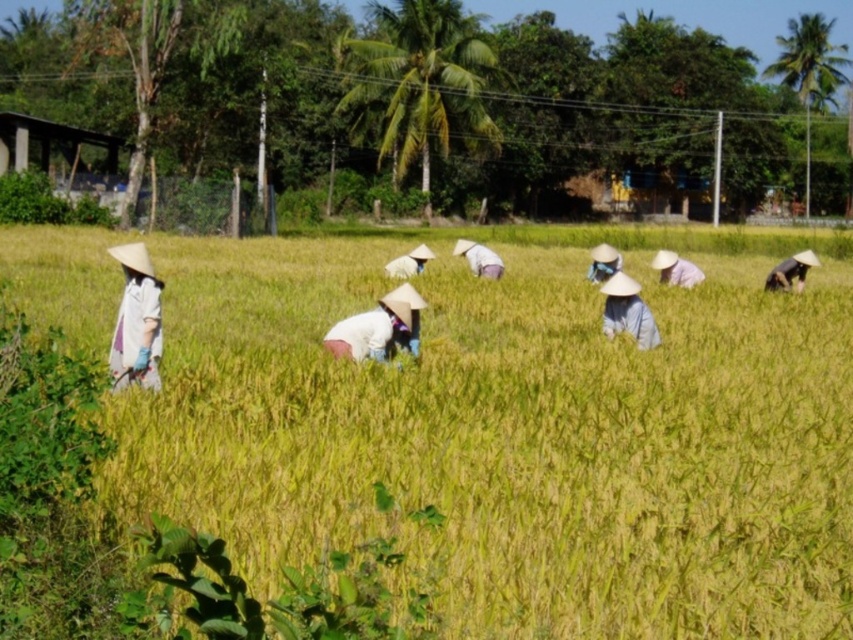
The image size is (853, 640). Describe the element at coordinates (136, 321) in the screenshot. I see `white cotton hat at left` at that location.

Which is behind, point (109, 344) or point (610, 244)?

Point (610, 244)

What are the coordinates of `white cotton hat at left` in the screenshot? It's located at (x=136, y=321).

Does white fabric hat at center appear on the left side of blue fabric headscarf at center?

Indeed, white fabric hat at center is positioned on the left side of blue fabric headscarf at center.

Does white fabric hat at center come in front of blue fabric headscarf at center?

No, it is not.

Is point (485, 260) in front of point (592, 264)?

That is False.

You are a GUI agent. You are given a task and a screenshot of the screen. Output one action in this format:
    pyautogui.click(x=<x>, y=<y>)
    Task: Click on the white fabric hat at center
    The width and height of the screenshot is (853, 640).
    Given the screenshot: What is the action you would take?
    pyautogui.click(x=479, y=259)

Which of these two, light blue fabric hat at center or white fabric hat at center, stands taller?

With more height is light blue fabric hat at center.

Measure the distance between light blue fabric hat at center and camera.

light blue fabric hat at center is 38.36 feet away from camera.

At what (x,y) coordinates should I click in order to perform the action: click on light blue fabric hat at center. Please return your answer as a coordinate pair (x, y). The width and height of the screenshot is (853, 640). Looking at the image, I should click on (627, 310).